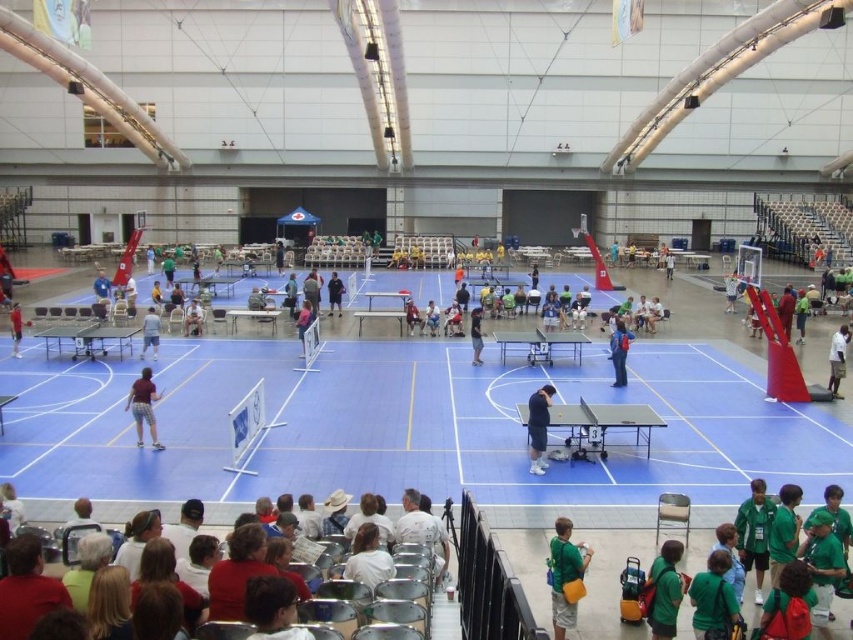
From the picture: You are a photographer positioned at the entrance of the sports hall. You need to take a photo that includes both the white matte shirt at center and the blue fabric shirt at center. Based on their positions, which shirt should you focus on first to ensure both are in the frame?

The white matte shirt at center is to the right of the blue fabric shirt at center, so you should focus on the blue fabric shirt at center first to ensure both are in the frame.

You are a photographer positioned at the back of the sports hall. You need to take a photo of both the dark blue shirt at center and the pink fabric shirt at center. Which shirt should you focus on first to ensure both are in the frame without moving the camera?

You should focus on the dark blue shirt at center first because it has a smaller width than the pink fabric shirt at center, allowing you to center the camera on the darker blue shirt first and still capture the wider pink fabric shirt in the frame.

You are a photographer setting up a camera to capture both the green jersey at lower right and the blue fabric shirt at center. Which object requires a wider lens to ensure it fits entirely in the frame?

The green jersey at lower right might be wider than blue fabric shirt at center, so the photographer should use a wider lens to capture the green jersey at lower right in its entirety.